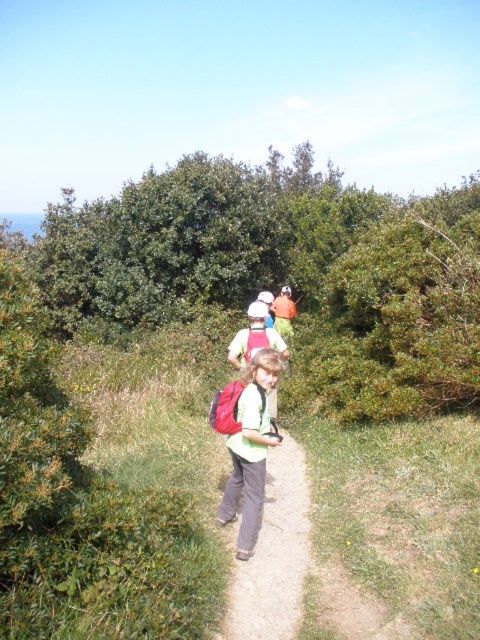
Question: Which point appears farthest from the camera in this image?

Choices:
 (A) (301, 572)
 (B) (262, 420)

Answer: (B)

Question: Is green fabric backpack at center positioned before matte green shirt at center?

Choices:
 (A) no
 (B) yes

Answer: (B)

Question: Is green fabric backpack at center below matte green shirt at center?

Choices:
 (A) yes
 (B) no

Answer: (A)

Question: Among these points, which one is nearest to the camera?

Choices:
 (A) (259, 436)
 (B) (291, 545)

Answer: (A)

Question: Is green fabric backpack at center smaller than matte green shirt at center?

Choices:
 (A) yes
 (B) no

Answer: (B)

Question: Which of the following is the closest to the observer?

Choices:
 (A) (287, 630)
 (B) (277, 369)

Answer: (A)